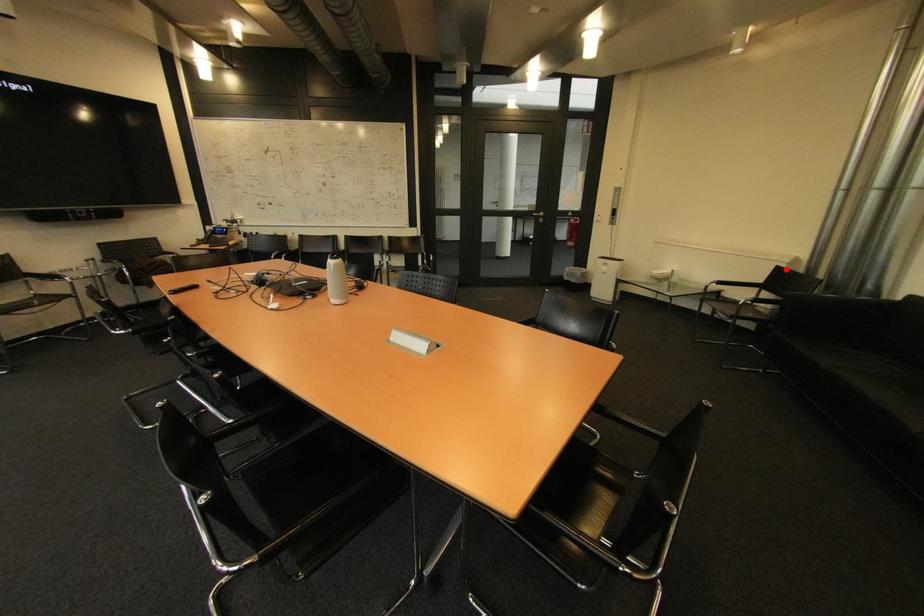
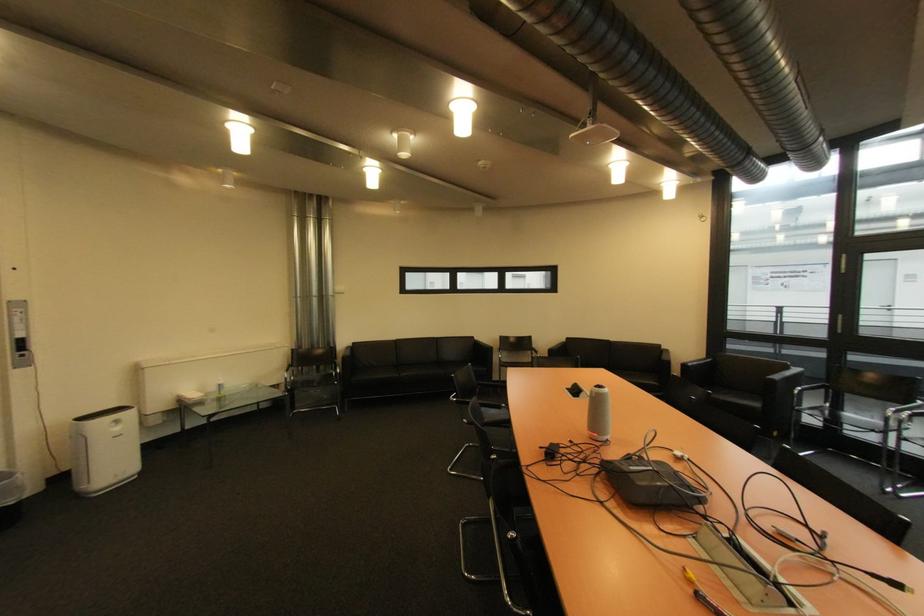
The point at the highlighted location is marked in the first image. Where is the corresponding point in the second image?

(301, 352)